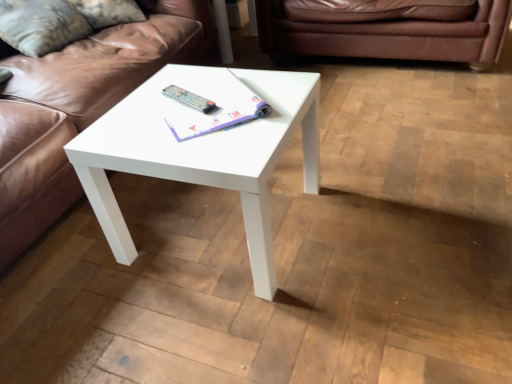
Question: Does velvet floral pillow at upper left touch brown leather couch at upper left, arranged as the 1th studio couch when viewed from the left?

Choices:
 (A) no
 (B) yes

Answer: (A)

Question: Does velvet floral pillow at upper left lie behind brown leather couch at upper left, which ranks as the 2th studio couch in right-to-left order?

Choices:
 (A) yes
 (B) no

Answer: (A)

Question: Would you say velvet floral pillow at upper left contains brown leather couch at upper left, which ranks as the 2th studio couch in right-to-left order?

Choices:
 (A) no
 (B) yes

Answer: (A)

Question: Is brown leather couch at upper left, arranged as the 1th studio couch when viewed from the left, at the back of velvet floral pillow at upper left?

Choices:
 (A) no
 (B) yes

Answer: (B)

Question: Is velvet floral pillow at upper left aimed at brown leather couch at upper left, arranged as the 1th studio couch when viewed from the left?

Choices:
 (A) yes
 (B) no

Answer: (A)

Question: Does velvet floral pillow at upper left have a greater height compared to brown leather couch at upper left, which ranks as the 2th studio couch in right-to-left order?

Choices:
 (A) yes
 (B) no

Answer: (B)

Question: Does brown leather couch at upper left, arranged as the 1th studio couch when viewed from the left, turn towards white paper book at center?

Choices:
 (A) no
 (B) yes

Answer: (B)

Question: Can you confirm if brown leather couch at upper left, which ranks as the 2th studio couch in right-to-left order, is smaller than white paper book at center?

Choices:
 (A) yes
 (B) no

Answer: (B)

Question: Is brown leather couch at upper left, arranged as the 1th studio couch when viewed from the left, thinner than white paper book at center?

Choices:
 (A) yes
 (B) no

Answer: (B)

Question: From the image's perspective, would you say brown leather couch at upper left, arranged as the 1th studio couch when viewed from the left, is shown under white paper book at center?

Choices:
 (A) yes
 (B) no

Answer: (B)

Question: Is brown leather couch at upper left, arranged as the 1th studio couch when viewed from the left, positioned far away from white paper book at center?

Choices:
 (A) no
 (B) yes

Answer: (A)

Question: Does brown leather couch at upper left, which ranks as the 2th studio couch in right-to-left order, come in front of white paper book at center?

Choices:
 (A) no
 (B) yes

Answer: (B)

Question: From the image's perspective, would you say silver metallic remote at center is positioned over brown leather couch at upper left, which ranks as the 2th studio couch in right-to-left order?

Choices:
 (A) yes
 (B) no

Answer: (B)